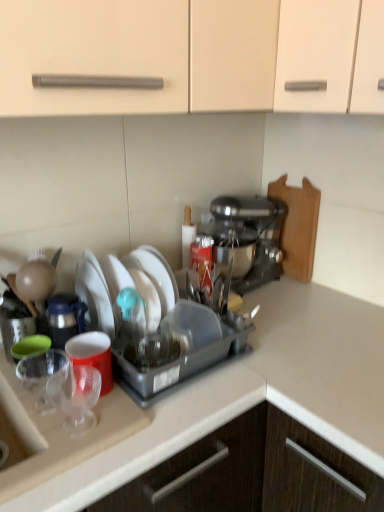
Question: Considering their positions, is white matte plate at center, the second tableware when ordered from front to back, located in front of or behind wooden cutting board at right?

Choices:
 (A) behind
 (B) front

Answer: (B)

Question: Is point (97, 261) positioned closer to the camera than point (309, 202)?

Choices:
 (A) closer
 (B) farther

Answer: (A)

Question: Which of these objects is positioned farthest from the transparent plastic cup at lower left, placed as the 2th tableware when sorted from top to bottom?

Choices:
 (A) transparent plastic cups at left
 (B) wooden cutting board at right
 (C) matte plastic cup at left
 (D) metallic silver stand mixer at center-right
 (E) white matte plate at center, the second tableware when ordered from front to back

Answer: (B)

Question: Considering the real-world distances, which object is farthest from the white matte plate at center, positioned as the 1th tableware in back-to-front order?

Choices:
 (A) matte plastic cup at left
 (B) transparent plastic cup at lower left, placed as the 2th tableware when sorted from top to bottom
 (C) wooden cutting board at right
 (D) metallic silver stand mixer at center-right
 (E) transparent plastic cups at left

Answer: (C)